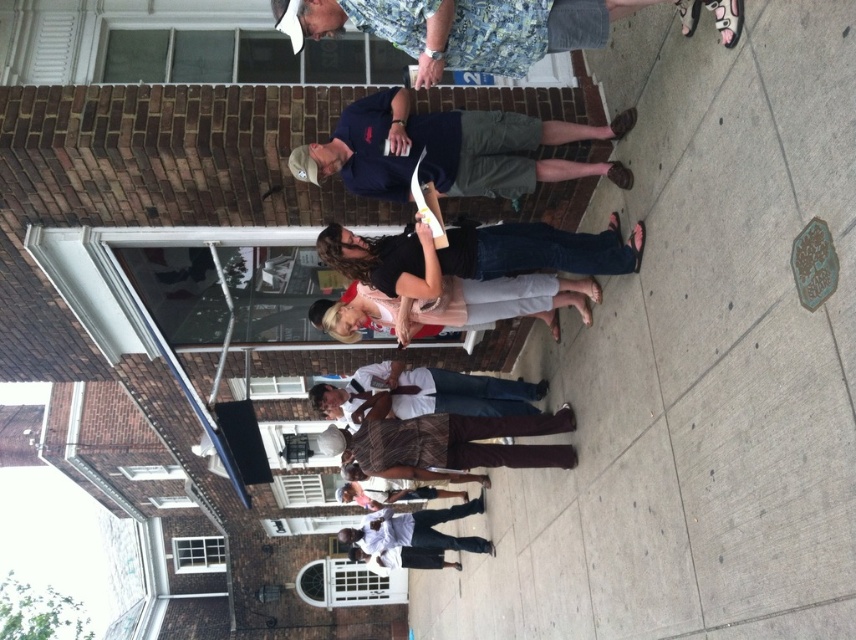
Question: Which object is farther from the camera taking this photo?

Choices:
 (A) dark blue shirt at center
 (B) brown plaid pants at center

Answer: (B)

Question: Which object is positioned closest to the brown plaid pants at center?

Choices:
 (A) dark blue shirt at center
 (B) white shirt at center
 (C) white cotton shirt at center

Answer: (B)

Question: Which object appears farthest from the camera in this image?

Choices:
 (A) white shirt at center
 (B) light pink sheer blouse at center
 (C) brown plaid pants at center

Answer: (A)

Question: Can you confirm if dark blue shirt at center is thinner than brown plaid pants at center?

Choices:
 (A) no
 (B) yes

Answer: (A)

Question: Can you confirm if dark blue shirt at center is smaller than brown plaid pants at center?

Choices:
 (A) no
 (B) yes

Answer: (A)

Question: Does brown plaid pants at center appear under white cotton shirt at center?

Choices:
 (A) yes
 (B) no

Answer: (B)